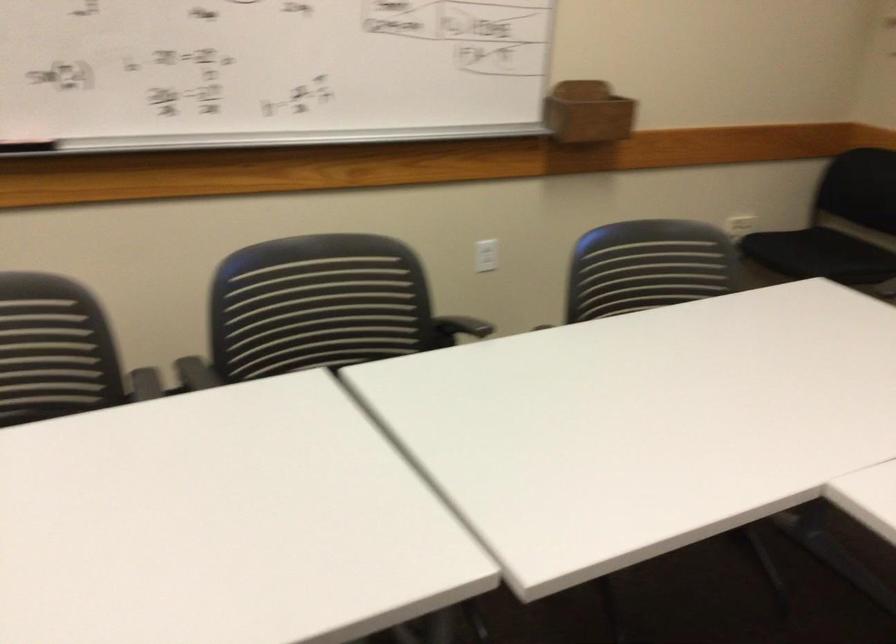
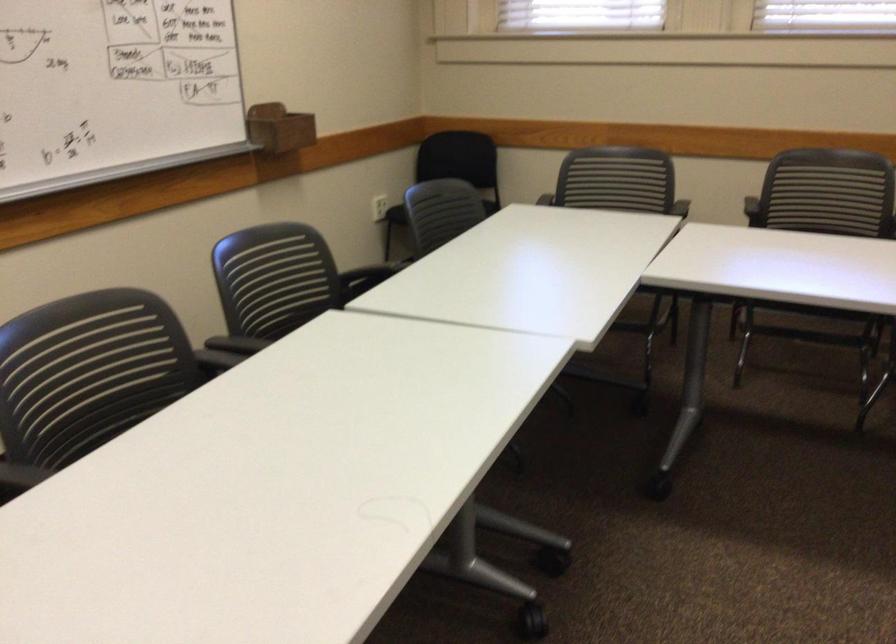
In the second image, find the point that corresponds to point 589,100 in the first image.

(279, 128)